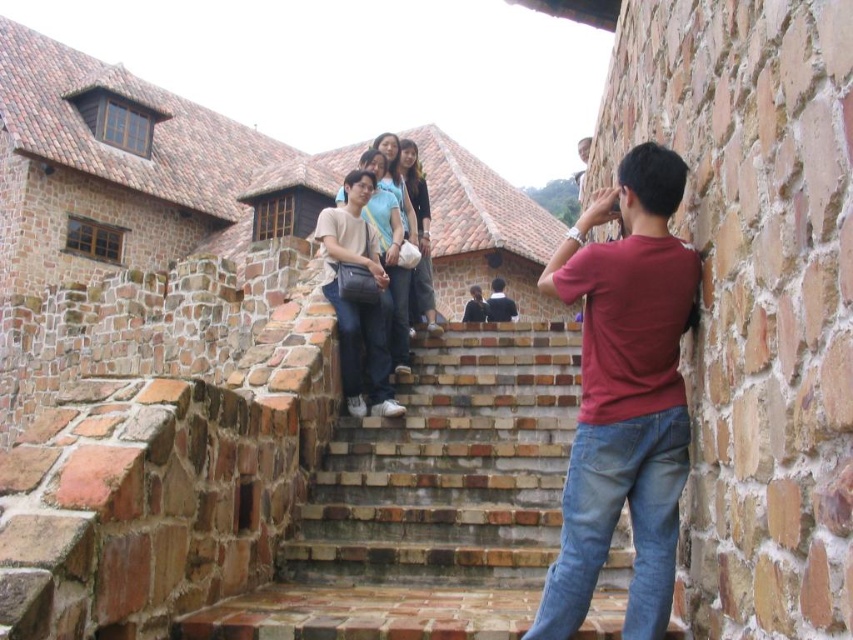
You are standing at the base of the stairs in the image. There are two points marked on the scene. The first point is at coordinates point (341, 317) and the second point is at coordinates point (416, 305). Which point is closer to you?

Point (341, 317) is closer to the camera than point (416, 305), so the first point is closer to you.